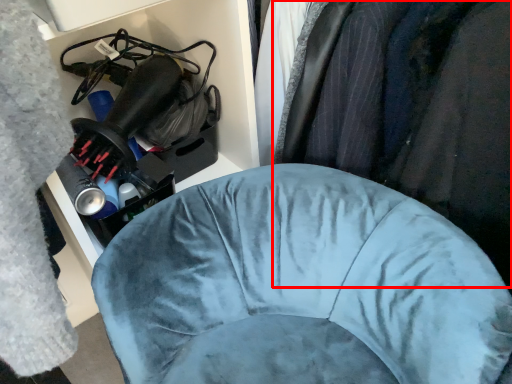
Question: From the image's perspective, where is clothing (annotated by the red box) located relative to furniture?

Choices:
 (A) above
 (B) below

Answer: (A)